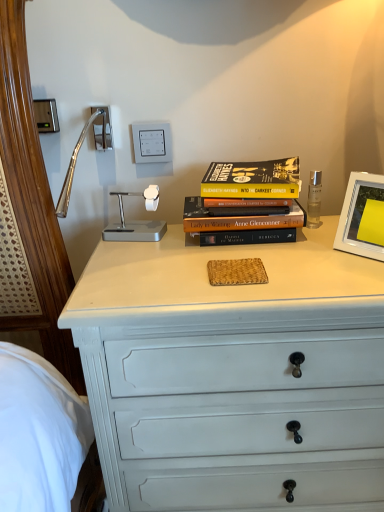
Question: From the image's perspective, relative to white plastic picture frame at upper right, is white plastic switch at upper center, which is the second electric outlet in left-to-right order, above or below?

Choices:
 (A) below
 (B) above

Answer: (B)

Question: Is white plastic switch at upper center, which appears as the first electric outlet when viewed from the right, inside or outside of white plastic picture frame at upper right?

Choices:
 (A) inside
 (B) outside

Answer: (B)

Question: Estimate the real-world distances between objects in this image. Which object is farther from the white plastic switch at upper center, which is the second electric outlet in left-to-right order?

Choices:
 (A) white plastic picture frame at upper right
 (B) hardcover book at center
 (C) satin nickel outlet at upper left, the second electric outlet viewed from the right
 (D) white painted wood chest of drawers at center

Answer: (D)

Question: Which object is the closest to the white plastic switch at upper center, which is the second electric outlet in left-to-right order?

Choices:
 (A) hardcover book at center
 (B) white painted wood chest of drawers at center
 (C) white plastic picture frame at upper right
 (D) satin nickel outlet at upper left, the second electric outlet viewed from the right

Answer: (D)